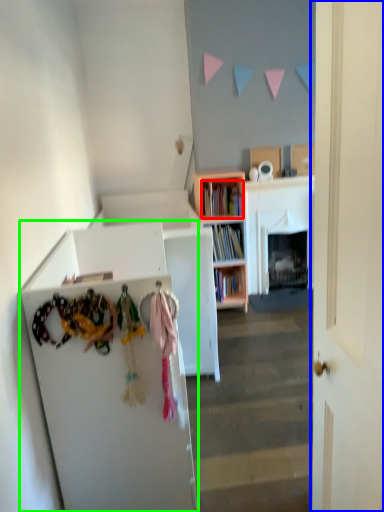
Question: Which is farther away from book (highlighted by a red box)? door (highlighted by a blue box) or cabinetry (highlighted by a green box)?

Choices:
 (A) door
 (B) cabinetry

Answer: (A)